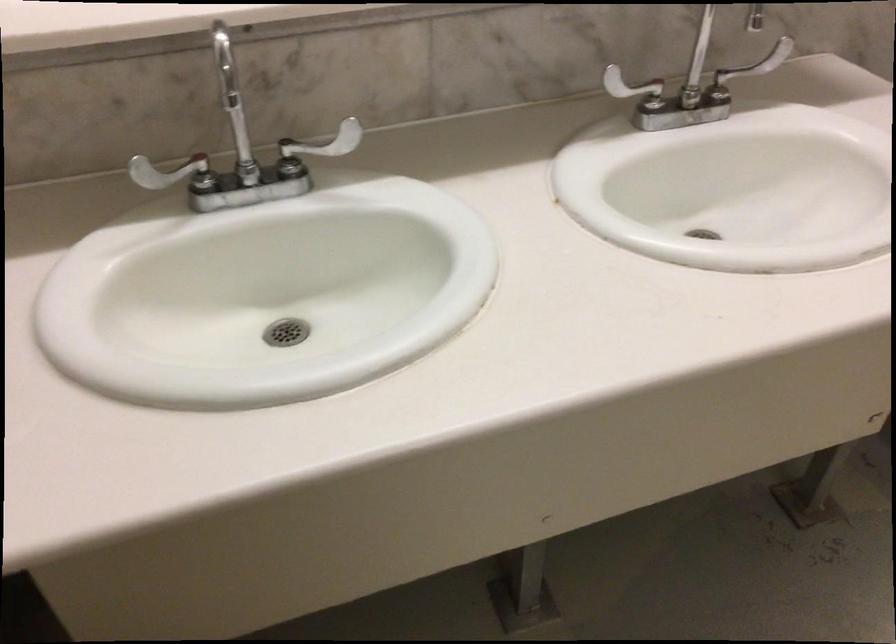
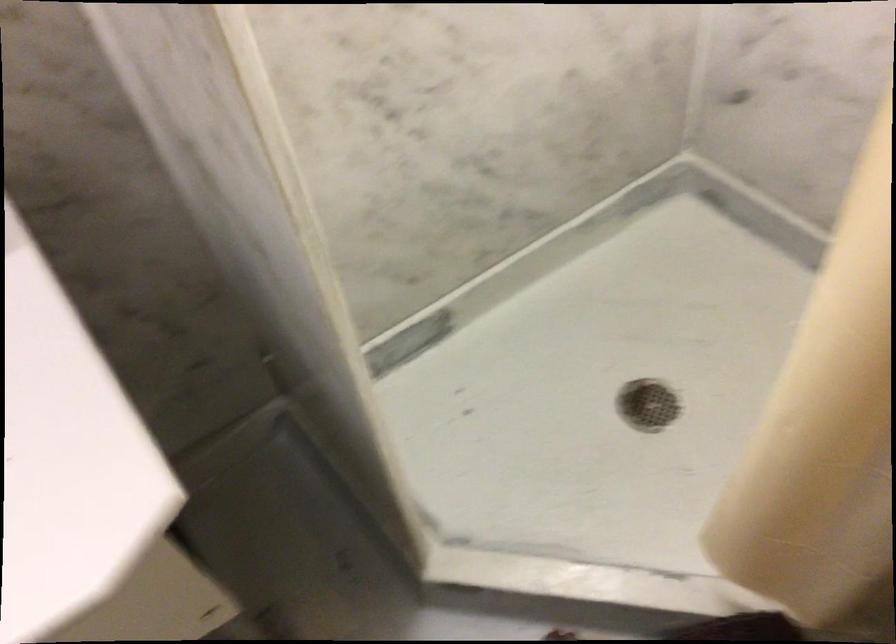
Question: Which direction would the cameraman need to move to produce the second image? Reply with the corresponding letter.

Choices:
 (A) Left
 (B) Right
 (C) Forward
 (D) Backward

Answer: (B)